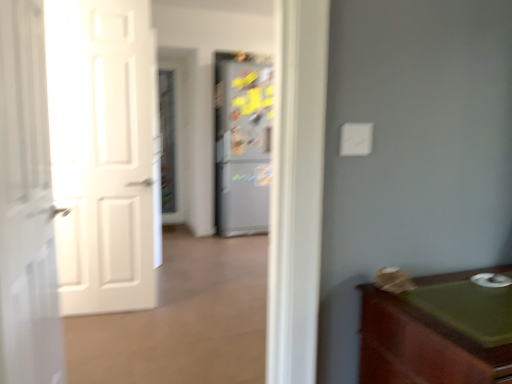
At what (x,y) coordinates should I click in order to perform the action: click on clear glass screen door at center. Please return your answer as a coordinate pair (x, y). The image size is (512, 384). Looking at the image, I should click on (x=167, y=140).

The height and width of the screenshot is (384, 512). What do you see at coordinates (167, 140) in the screenshot?
I see `clear glass screen door at center` at bounding box center [167, 140].

Locate an element on the screen. The image size is (512, 384). green wood cabinet at lower right is located at coordinates (438, 332).

The image size is (512, 384). Identify the location of metallic gray refrigerator at center. (243, 147).

Is white matte door at left, arranged as the 2th door when viewed from the front, not within white glossy door at left, positioned as the second door in back-to-front order?

Indeed, white matte door at left, arranged as the 2th door when viewed from the front, is completely outside white glossy door at left, positioned as the second door in back-to-front order.

The height and width of the screenshot is (384, 512). I want to click on door on the right of white matte door at left, arranged as the 2th door when viewed from the front, so click(26, 204).

Visually, is white matte door at left, the first door in the back-to-front sequence, positioned to the left or to the right of white glossy door at left, the 1th door viewed from the front?

From the image, it's evident that white matte door at left, the first door in the back-to-front sequence, is to the left of white glossy door at left, the 1th door viewed from the front.

Who is more distant, white matte door at left, the first door in the back-to-front sequence, or white glossy door at left, the 1th door viewed from the front?

white matte door at left, the first door in the back-to-front sequence, is more distant.

What's the angular difference between white glossy door at left, the 1th door viewed from the front, and white matte door at left, arranged as the 2th door when viewed from the front,'s facing directions?

white glossy door at left, the 1th door viewed from the front, and white matte door at left, arranged as the 2th door when viewed from the front, are facing 91.8 degrees away from each other.

Considering the relative sizes of white glossy door at left, the 1th door viewed from the front, and white matte door at left, arranged as the 2th door when viewed from the front, in the image provided, is white glossy door at left, the 1th door viewed from the front, thinner than white matte door at left, arranged as the 2th door when viewed from the front,?

No.

Considering the sizes of objects white glossy door at left, the 1th door viewed from the front, and white matte door at left, the first door in the back-to-front sequence, in the image provided, who is taller, white glossy door at left, the 1th door viewed from the front, or white matte door at left, the first door in the back-to-front sequence,?

white matte door at left, the first door in the back-to-front sequence, is taller.

From a real-world perspective, is white glossy door at left, the 1th door viewed from the front, on white matte door at left, arranged as the 2th door when viewed from the front?

No.

From the image's perspective, is green wood cabinet at lower right on top of white matte door at left, the first door in the back-to-front sequence?

Incorrect, from the image's perspective, green wood cabinet at lower right is lower than white matte door at left, the first door in the back-to-front sequence.

Is green wood cabinet at lower right next to white matte door at left, arranged as the 2th door when viewed from the front?

No, green wood cabinet at lower right is not touching white matte door at left, arranged as the 2th door when viewed from the front.

Which of these two, green wood cabinet at lower right or white matte door at left, the first door in the back-to-front sequence, is wider?

green wood cabinet at lower right is wider.

Where is `door that is the 1st one when counting downward from the metallic gray refrigerator at center (from the image's perspective)`? This screenshot has height=384, width=512. door that is the 1st one when counting downward from the metallic gray refrigerator at center (from the image's perspective) is located at coordinates 104,153.

In the scene shown: Do you think white matte door at left, arranged as the 2th door when viewed from the front, is within metallic gray refrigerator at center, or outside of it?

white matte door at left, arranged as the 2th door when viewed from the front, exists outside the volume of metallic gray refrigerator at center.

From the image's perspective, is white matte door at left, arranged as the 2th door when viewed from the front, positioned above or below metallic gray refrigerator at center?

white matte door at left, arranged as the 2th door when viewed from the front, is situated lower than metallic gray refrigerator at center in the image.

Which of these two, metallic gray refrigerator at center or green wood cabinet at lower right, is wider?

metallic gray refrigerator at center is wider.

Which of these two, metallic gray refrigerator at center or green wood cabinet at lower right, stands shorter?

green wood cabinet at lower right is shorter.

From a real-world perspective, is metallic gray refrigerator at center below green wood cabinet at lower right?

No, from a real-world perspective, metallic gray refrigerator at center is not beneath green wood cabinet at lower right.

Does metallic gray refrigerator at center come in front of green wood cabinet at lower right?

No.

Is metallic gray refrigerator at center next to white glossy door at left, the 1th door viewed from the front, and touching it?

No, metallic gray refrigerator at center is not next to white glossy door at left, the 1th door viewed from the front.

From a real-world perspective, is metallic gray refrigerator at center positioned under white glossy door at left, the 1th door viewed from the front, based on gravity?

No, from a real-world perspective, metallic gray refrigerator at center is not under white glossy door at left, the 1th door viewed from the front.

Find the location of a particular element. refrigerator that is behind the white glossy door at left, positioned as the second door in back-to-front order is located at coordinates (243, 147).

Based on their sizes in the image, would you say metallic gray refrigerator at center is bigger or smaller than white glossy door at left, positioned as the second door in back-to-front order?

metallic gray refrigerator at center is bigger than white glossy door at left, positioned as the second door in back-to-front order.

This screenshot has height=384, width=512. I want to click on screen door lying above the metallic gray refrigerator at center (from the image's perspective), so click(167, 140).

From their relative heights in the image, would you say metallic gray refrigerator at center is taller or shorter than clear glass screen door at center?

In the image, metallic gray refrigerator at center appears to be shorter than clear glass screen door at center.

Is metallic gray refrigerator at center closer to the viewer compared to clear glass screen door at center?

Yes, metallic gray refrigerator at center is closer to the camera.

This screenshot has width=512, height=384. Find the location of `door above the white glossy door at left, the 1th door viewed from the front (from the image's perspective)`. door above the white glossy door at left, the 1th door viewed from the front (from the image's perspective) is located at coordinates (104, 153).

Find the location of `door located above the white glossy door at left, the 1th door viewed from the front (from a real-world perspective)`. door located above the white glossy door at left, the 1th door viewed from the front (from a real-world perspective) is located at coordinates (104, 153).

When comparing their distances from metallic gray refrigerator at center, does clear glass screen door at center or white glossy door at left, positioned as the second door in back-to-front order, seem further?

Among the two, white glossy door at left, positioned as the second door in back-to-front order, is located further to metallic gray refrigerator at center.

When comparing their distances from clear glass screen door at center, does white glossy door at left, the 1th door viewed from the front, or metallic gray refrigerator at center seem closer?

metallic gray refrigerator at center is positioned closer to the anchor clear glass screen door at center.

Considering their positions, is green wood cabinet at lower right positioned further to clear glass screen door at center than metallic gray refrigerator at center?

The object further to clear glass screen door at center is green wood cabinet at lower right.

Looking at the image, which one is located closer to white glossy door at left, the 1th door viewed from the front, clear glass screen door at center or metallic gray refrigerator at center?

metallic gray refrigerator at center is closer to white glossy door at left, the 1th door viewed from the front.

Looking at the image, which one is located further to clear glass screen door at center, white glossy door at left, positioned as the second door in back-to-front order, or green wood cabinet at lower right?

Among the two, green wood cabinet at lower right is located further to clear glass screen door at center.

When comparing their distances from metallic gray refrigerator at center, does white glossy door at left, positioned as the second door in back-to-front order, or green wood cabinet at lower right seem further?

green wood cabinet at lower right is positioned further to the anchor metallic gray refrigerator at center.

From the image, which object appears to be nearer to white matte door at left, the first door in the back-to-front sequence, green wood cabinet at lower right or white glossy door at left, the 1th door viewed from the front?

Based on the image, white glossy door at left, the 1th door viewed from the front, appears to be nearer to white matte door at left, the first door in the back-to-front sequence.

When comparing their distances from white glossy door at left, the 1th door viewed from the front, does green wood cabinet at lower right or metallic gray refrigerator at center seem closer?

green wood cabinet at lower right.

Where is `refrigerator positioned between green wood cabinet at lower right and clear glass screen door at center from near to far`? refrigerator positioned between green wood cabinet at lower right and clear glass screen door at center from near to far is located at coordinates (243, 147).

Image resolution: width=512 pixels, height=384 pixels. In order to click on door between white glossy door at left, the 1th door viewed from the front, and metallic gray refrigerator at center, along the z-axis in this screenshot , I will do pyautogui.click(x=104, y=153).

Locate an element on the screen. The height and width of the screenshot is (384, 512). door between white glossy door at left, the 1th door viewed from the front, and clear glass screen door at center, along the z-axis is located at coordinates (104, 153).

I want to click on refrigerator located between white glossy door at left, positioned as the second door in back-to-front order, and clear glass screen door at center in the depth direction, so click(243, 147).